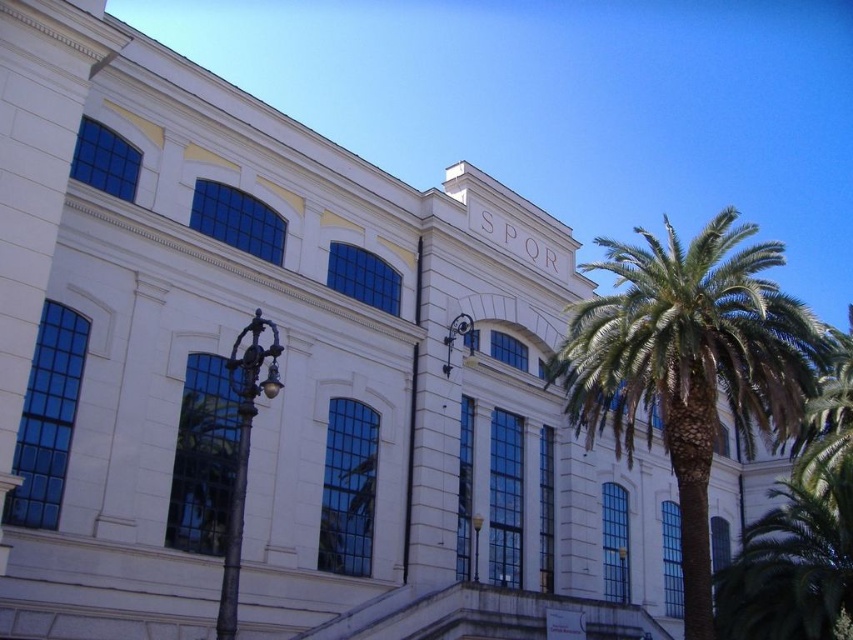
Question: Can you confirm if green leafy palm tree at right is positioned below white glossy clock at upper center?

Choices:
 (A) no
 (B) yes

Answer: (B)

Question: Is green leafy palm tree at right below white glossy clock at upper center?

Choices:
 (A) yes
 (B) no

Answer: (A)

Question: Can you confirm if green leafy palm tree at right is smaller than white glossy clock at upper center?

Choices:
 (A) yes
 (B) no

Answer: (B)

Question: Which object is closer to the camera taking this photo?

Choices:
 (A) green leafy palm tree at right
 (B) white glossy clock at upper center

Answer: (A)